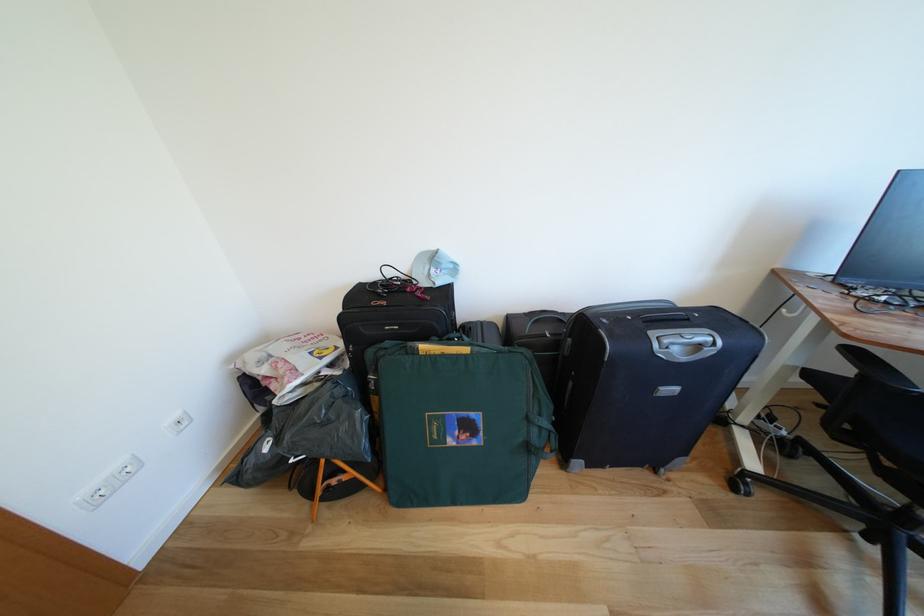
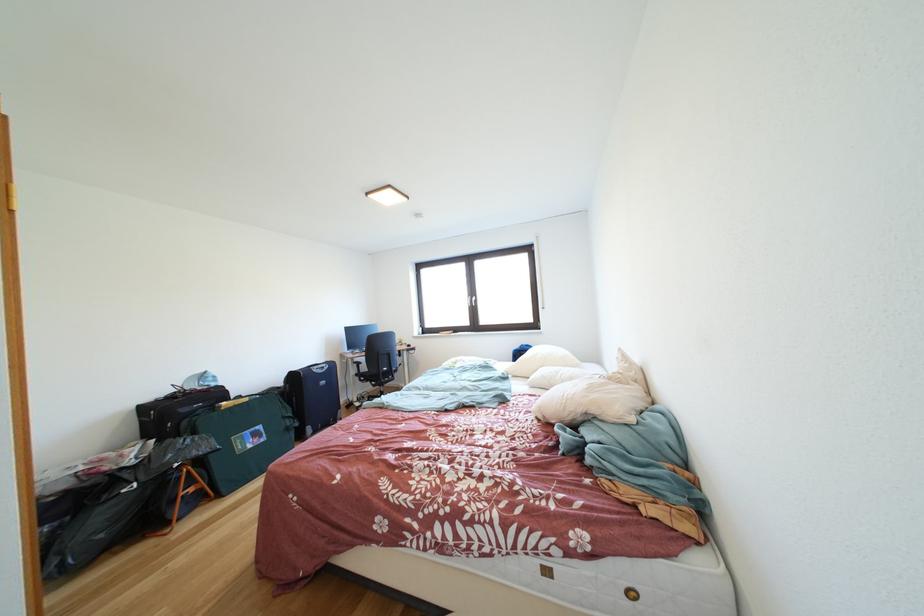
Where in the second image is the point corresponding to (893,477) from the first image?

(383, 391)